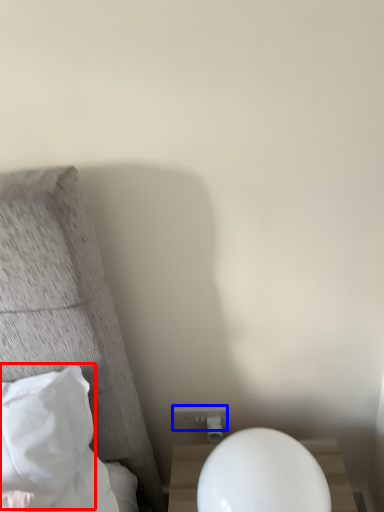
Question: Which point is closer to the camera, pillow (highlighted by a red box) or electric outlet (highlighted by a blue box)?

Choices:
 (A) pillow
 (B) electric outlet

Answer: (A)